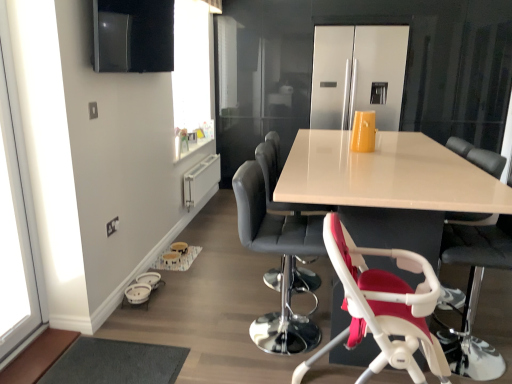
Locate an element on the screen. The height and width of the screenshot is (384, 512). vacant space to the left of black leather bar stool at center, marked as the 2th chair in a back-to-front arrangement is located at coordinates (208, 331).